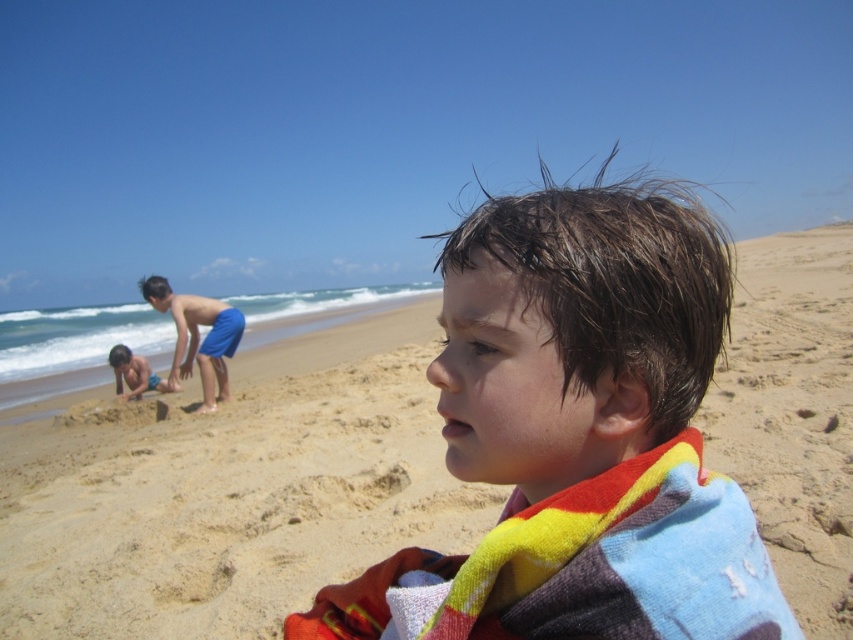
You are a photographer trying to capture a candid shot of the child with the wet hair towel at center and the child in blue shorts at center. Since you want to focus on the child with the smaller object, which child should you zoom in on?

The wet hair towel at center has a smaller size compared to blue shorts at center, so you should zoom in on the child with the wet hair towel at center.

You are a photographer trying to capture the beach scene. You notice two pairs of blue shorts at center and blue shorts at lower left. Which pair of blue shorts should you focus on to ensure they are the wider ones in your photo?

The blue shorts at center might be wider than blue shorts at lower left, so focusing on the blue shorts at center would likely capture the wider ones in your photo.

You are a parent trying to decide which item to grab first from the beach scene. The wet hair towel at center and the blue shorts at lower left are both in view. Which item is narrower?

The wet hair towel at center is narrower than the blue shorts at lower left.